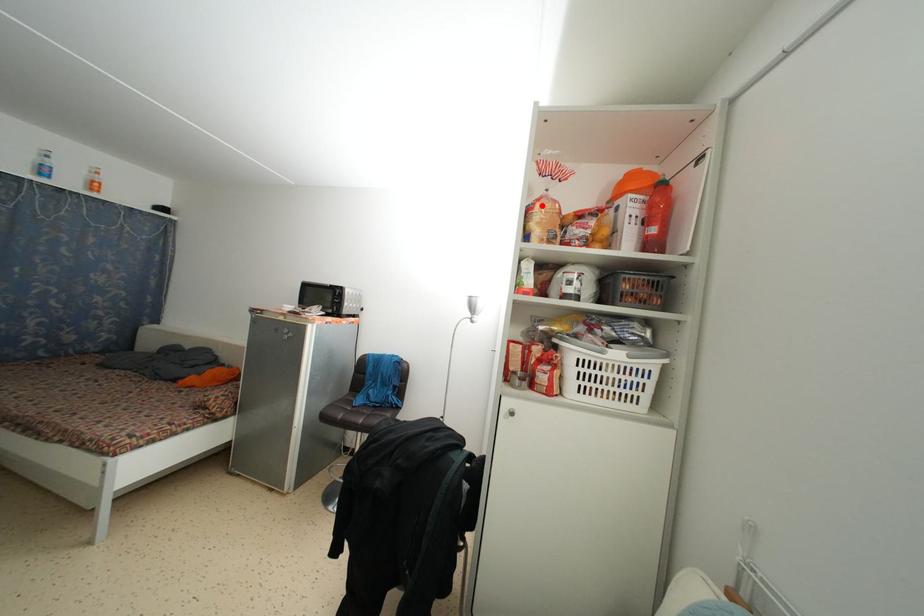
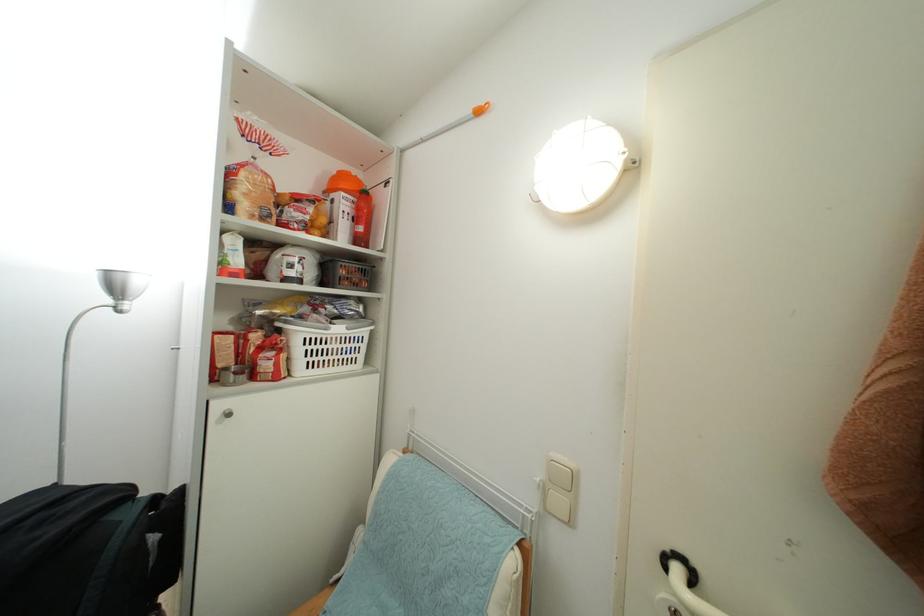
The point at the highlighted location is marked in the first image. Where is the corresponding point in the second image?

(246, 171)